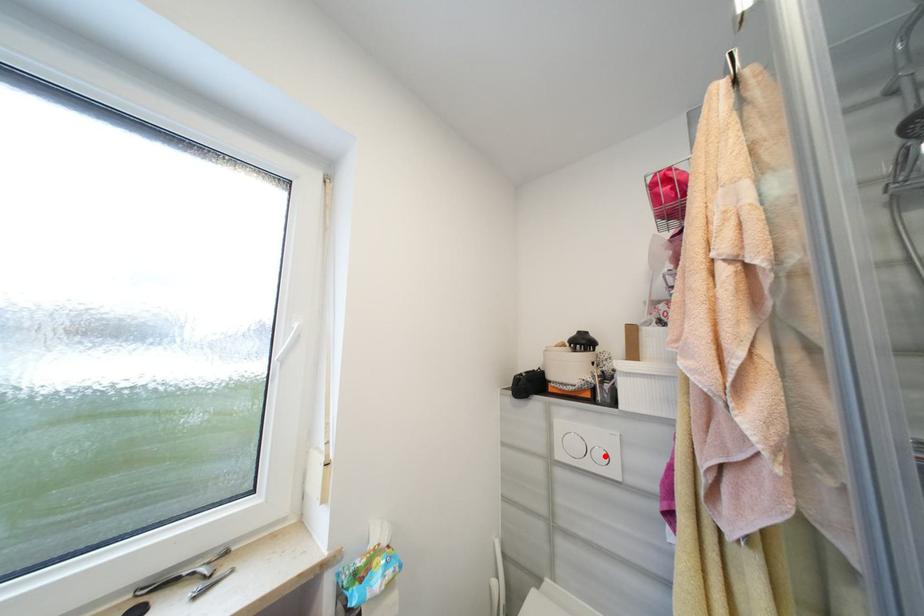
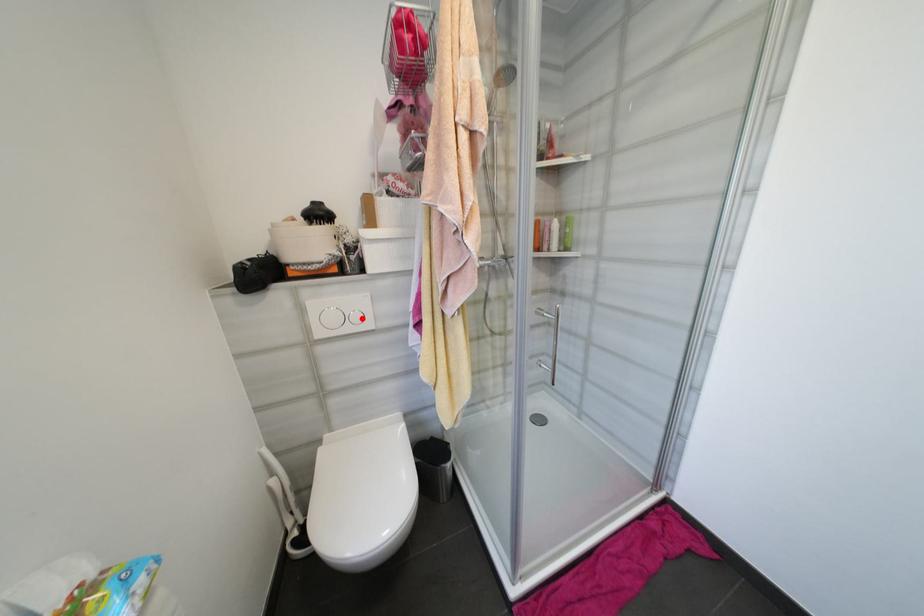
I am providing you with two images of the same scene from different viewpoints. A red point is marked on the first image and another point is marked on the second image. Is the marked point in image1 the same physical position as the marked point in image2?

Yes